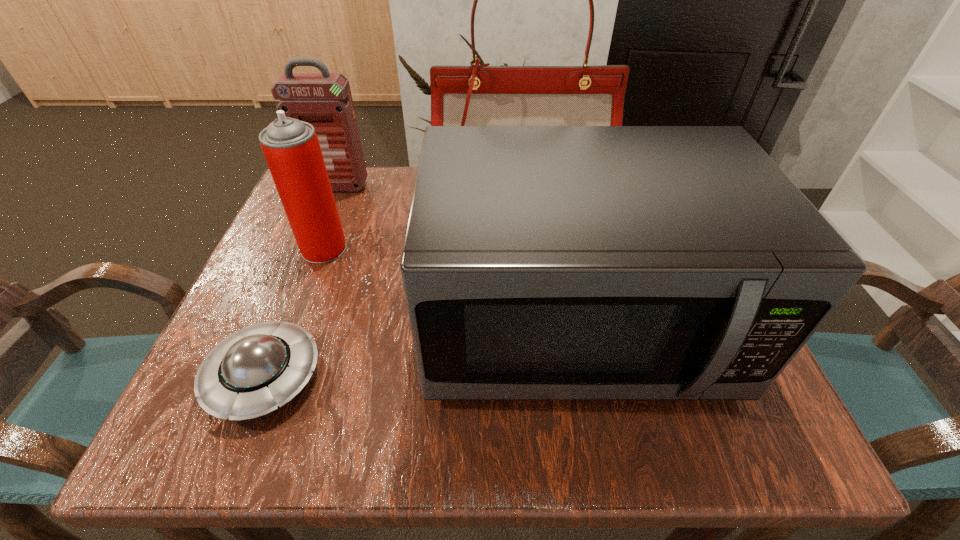
Locate an element on the screen. object present at the far right corner is located at coordinates pos(478,95).

The image size is (960, 540). I want to click on object that is at the near right corner, so click(x=540, y=262).

Locate an element on the screen. Image resolution: width=960 pixels, height=540 pixels. free region at the far edge of the desktop is located at coordinates [389, 176].

Identify the location of vacant space at the near edge. This screenshot has width=960, height=540. (332, 409).

Locate an element on the screen. This screenshot has width=960, height=540. free spot at the near right corner of the desktop is located at coordinates (749, 442).

Locate an element on the screen. empty space between the aerosol can and the saucer is located at coordinates (294, 313).

At what (x,y) coordinates should I click in order to perform the action: click on free space between the aerosol can and the saucer. Please return your answer as a coordinate pair (x, y). The width and height of the screenshot is (960, 540). Looking at the image, I should click on (294, 313).

Image resolution: width=960 pixels, height=540 pixels. What are the coordinates of `vacant area that lies between the saucer and the handbag` in the screenshot? It's located at (393, 281).

The width and height of the screenshot is (960, 540). Identify the location of free space between the saucer and the first-aid kit. (300, 282).

The image size is (960, 540). What are the coordinates of `unoccupied area between the shortest object and the handbag` in the screenshot? It's located at (393, 281).